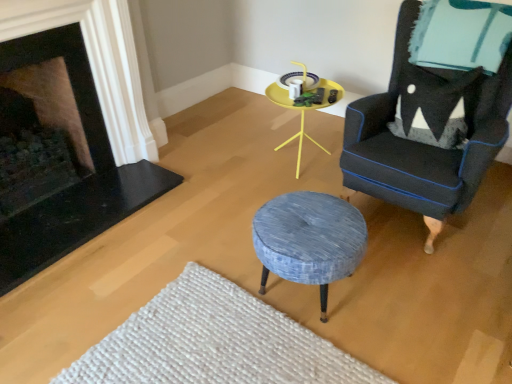
The image size is (512, 384). What are the coordinates of `free spot below textured blue fabric stool at center (from a real-world perspective)` in the screenshot? It's located at click(x=303, y=298).